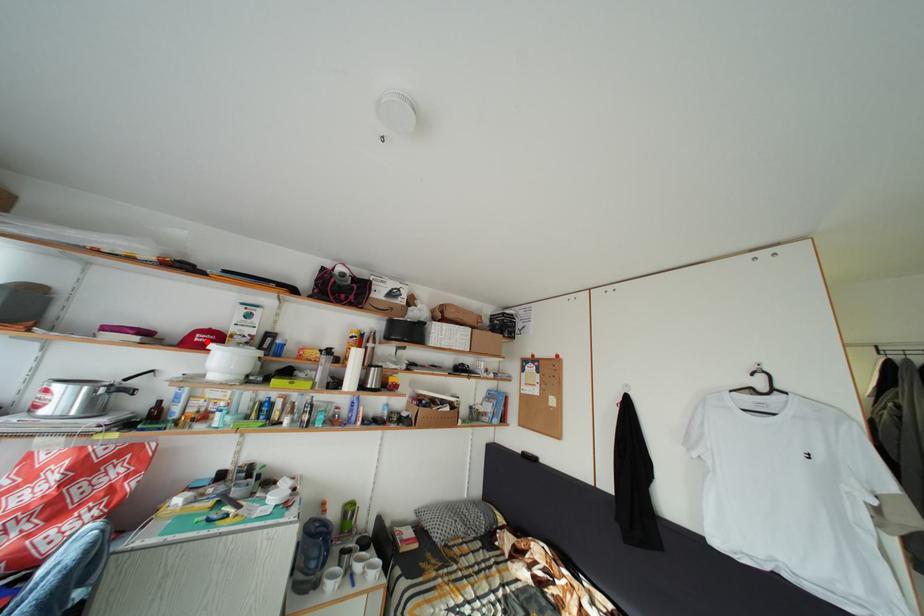
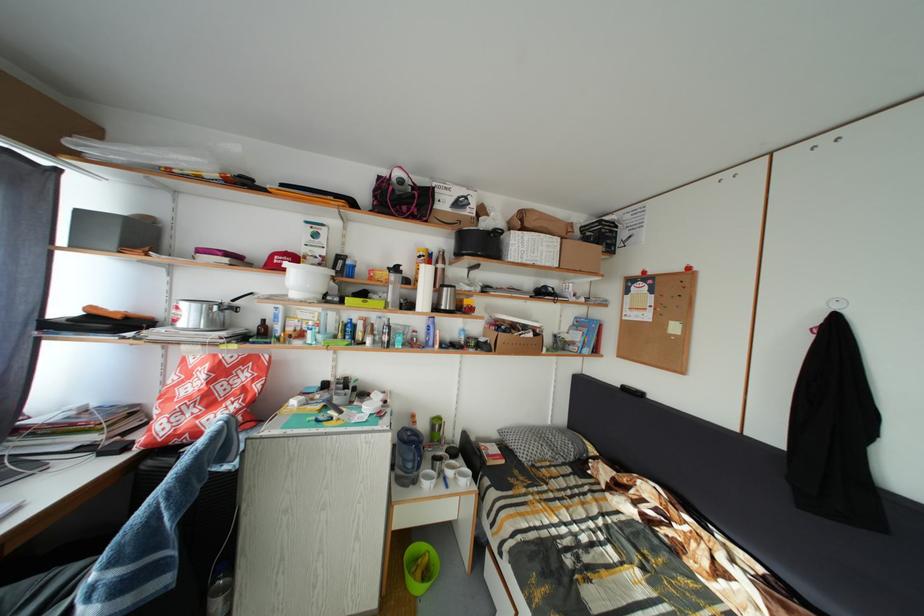
In the second image, find the point that corresponds to the highlighted location in the first image.

(285, 264)